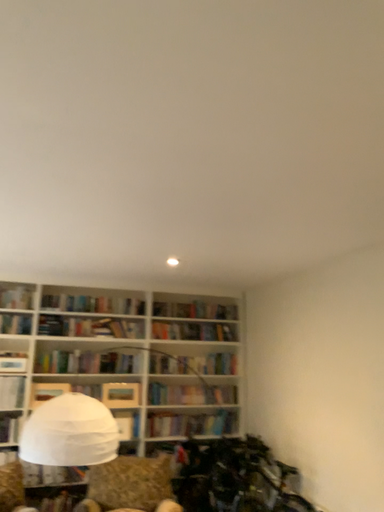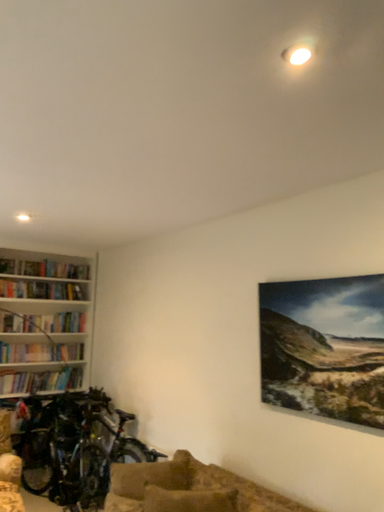
Question: Which way did the camera rotate in the video?

Choices:
 (A) rotated right
 (B) rotated left

Answer: (A)